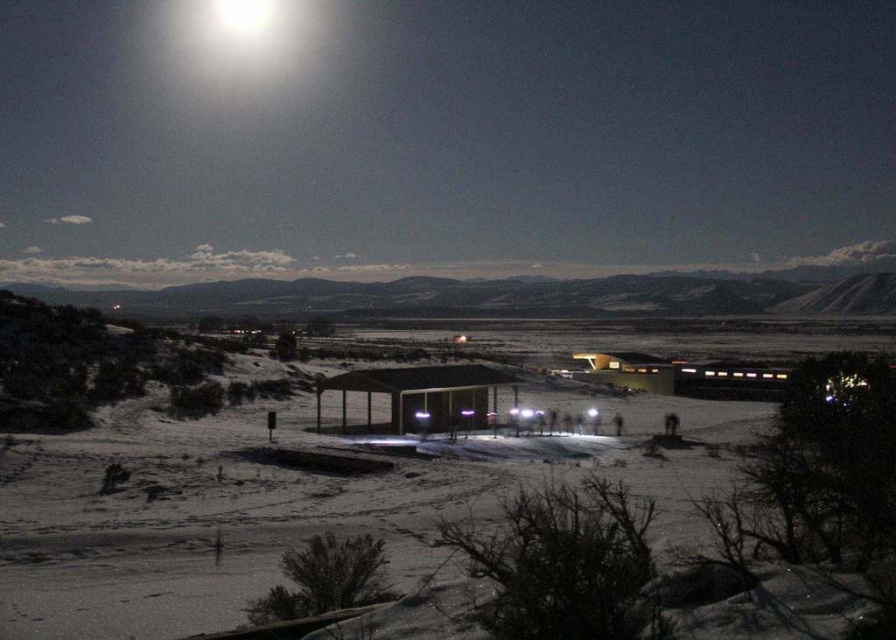
Does bright white sky at upper center have a smaller size compared to matte wood hut at center?

No.

What are the coordinates of `bright white sky at upper center` in the screenshot? It's located at (438, 134).

Does bright white sky at upper center appear over bright white light at upper center?

Incorrect, bright white sky at upper center is not positioned above bright white light at upper center.

Does bright white sky at upper center have a smaller size compared to bright white light at upper center?

No.

Where is `bright white sky at upper center`? bright white sky at upper center is located at coordinates (438, 134).

Between matte wood hut at center and bright white light at upper center, which one appears on the left side from the viewer's perspective?

Positioned to the left is bright white light at upper center.

Measure the distance between point (395,388) and camera.

They are 218.65 feet apart.

Identify the location of matte wood hut at center. (419, 396).